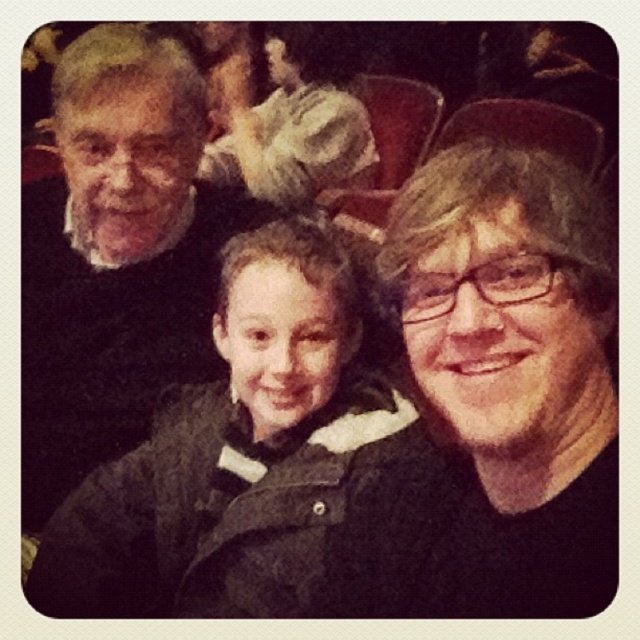
Is point (157, 104) farther from camera compared to point (346, 166)?

No.

Does point (161, 180) lie in front of point (232, 33)?

Yes, point (161, 180) is closer to viewer.

Is point (92, 204) farther from viewer compared to point (236, 147)?

No.

In order to click on dark gray sweater at upper left in this screenshot , I will do [113, 248].

From the picture: Who is positioned more to the left, matte black jacket at center or dark gray fuzzy coat at center?

dark gray fuzzy coat at center is more to the left.

You are a GUI agent. You are given a task and a screenshot of the screen. Output one action in this format:
    pyautogui.click(x=<x>, y=<y>)
    Task: Click on the matte black jacket at center
    
    Given the screenshot: What is the action you would take?
    pyautogui.click(x=493, y=401)

You are a GUI agent. You are given a task and a screenshot of the screen. Output one action in this format:
    pyautogui.click(x=<x>, y=<y>)
    Task: Click on the matte black jacket at center
    The height and width of the screenshot is (640, 640).
    Given the screenshot: What is the action you would take?
    pyautogui.click(x=493, y=401)

Is point (246, 330) positioned in front of point (22, 353)?

That is True.

Between dark gray fuzzy coat at center and dark gray sweater at upper left, which one is positioned lower?

dark gray fuzzy coat at center is below.

In order to click on dark gray fuzzy coat at center in this screenshot , I will do `click(232, 451)`.